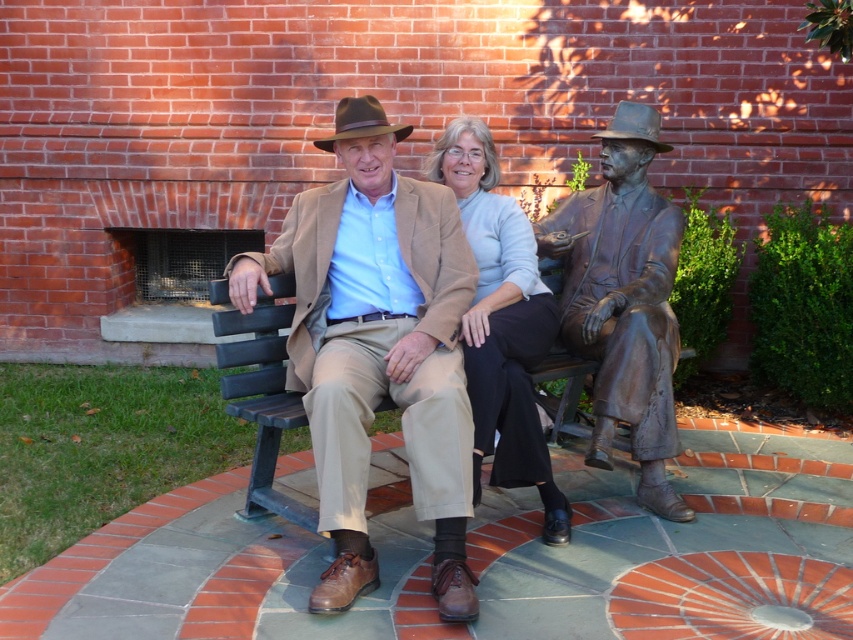
Does matte beige sweater at center have a lesser height compared to brown felt hat at center?

No, matte beige sweater at center is not shorter than brown felt hat at center.

Which is in front, point (531, 476) or point (387, 124)?

Positioned in front is point (531, 476).

Is point (515, 387) more distant than point (384, 132)?

No, it is not.

This screenshot has height=640, width=853. Identify the location of matte beige sweater at center. (502, 321).

Is matte brown leather jacket at center to the right of bronze statue at right from the viewer's perspective?

In fact, matte brown leather jacket at center is to the left of bronze statue at right.

Is the position of matte brown leather jacket at center less distant than that of bronze statue at right?

Yes, it is in front of bronze statue at right.

Is point (431, 464) positioned behind point (657, 381)?

No, it is not.

In order to click on matte brown leather jacket at center in this screenshot , I will do `click(376, 355)`.

Is matte beige sweater at center bigger than shiny bronze cowboy hat at center?

Yes, matte beige sweater at center is bigger than shiny bronze cowboy hat at center.

Is matte beige sweater at center smaller than shiny bronze cowboy hat at center?

Incorrect, matte beige sweater at center is not smaller in size than shiny bronze cowboy hat at center.

Is point (474, 129) closer to viewer compared to point (637, 120)?

Yes, it is in front of point (637, 120).

This screenshot has width=853, height=640. Find the location of `matte beige sweater at center`. matte beige sweater at center is located at coordinates (502, 321).